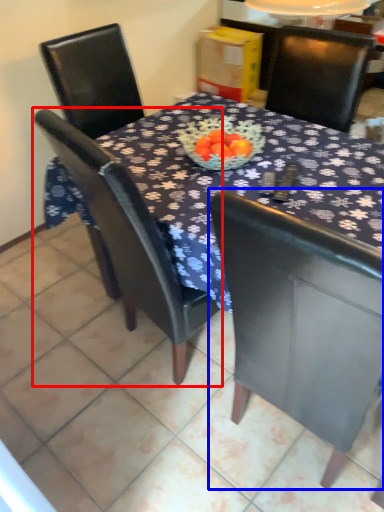
Question: Which point is closer to the camera, chair (highlighted by a red box) or chair (highlighted by a blue box)?

Choices:
 (A) chair
 (B) chair

Answer: (B)